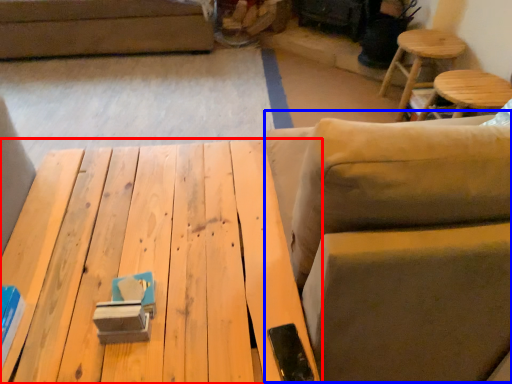
Question: Which of the following is the farthest to the observer, table (highlighted by a red box) or swivel chair (highlighted by a blue box)?

Choices:
 (A) table
 (B) swivel chair

Answer: (A)